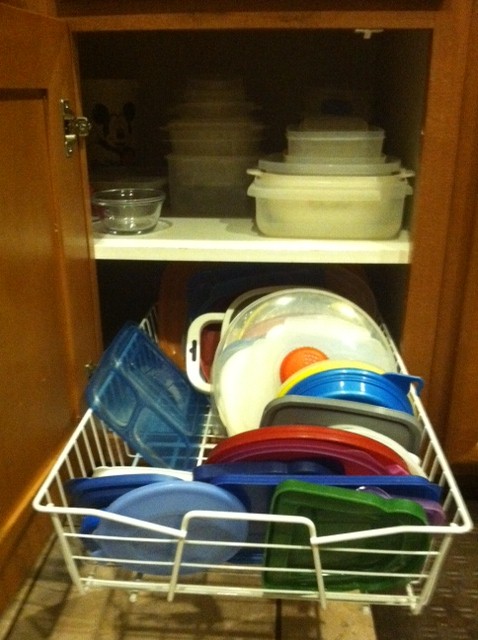
Where is `handle`? handle is located at coordinates (182, 353).